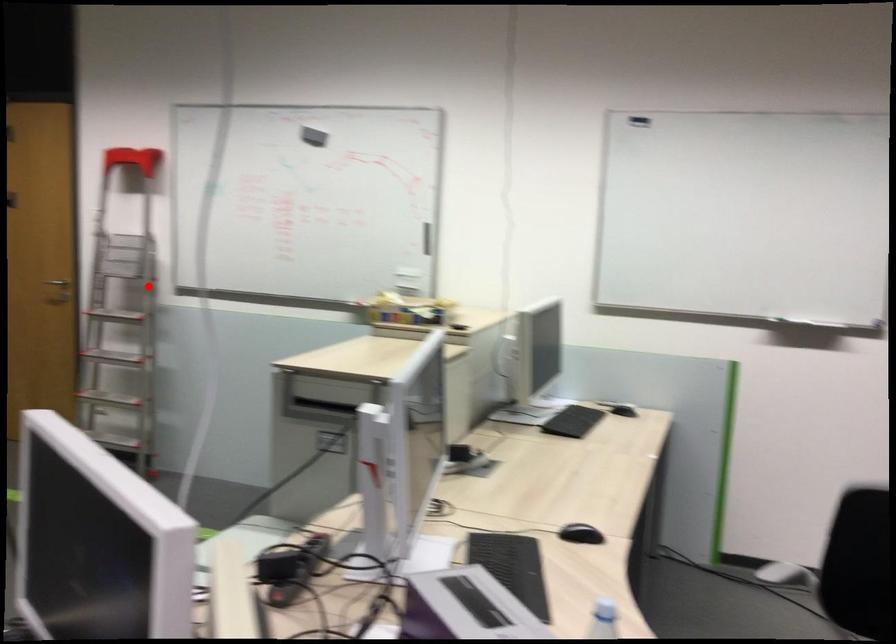
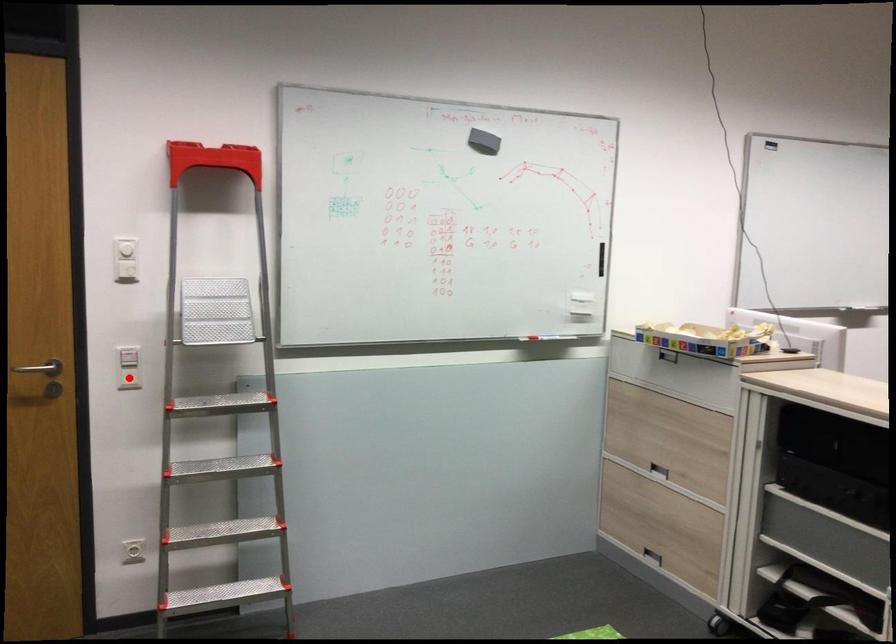
I am providing you with two images of the same scene from different viewpoints. A red point is marked on the first image and another point is marked on the second image. Does the point marked in image1 correspond to the same location as the one in image2?

Yes